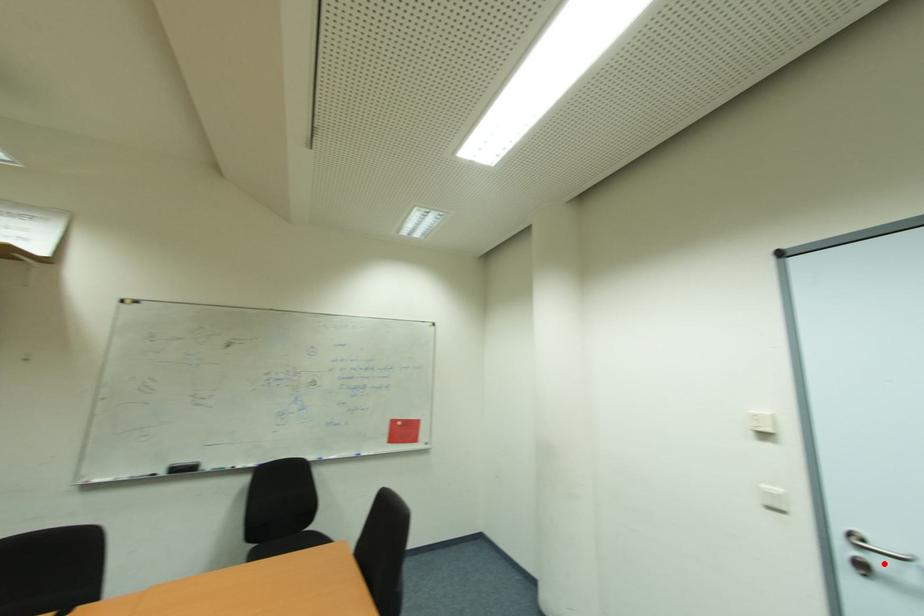
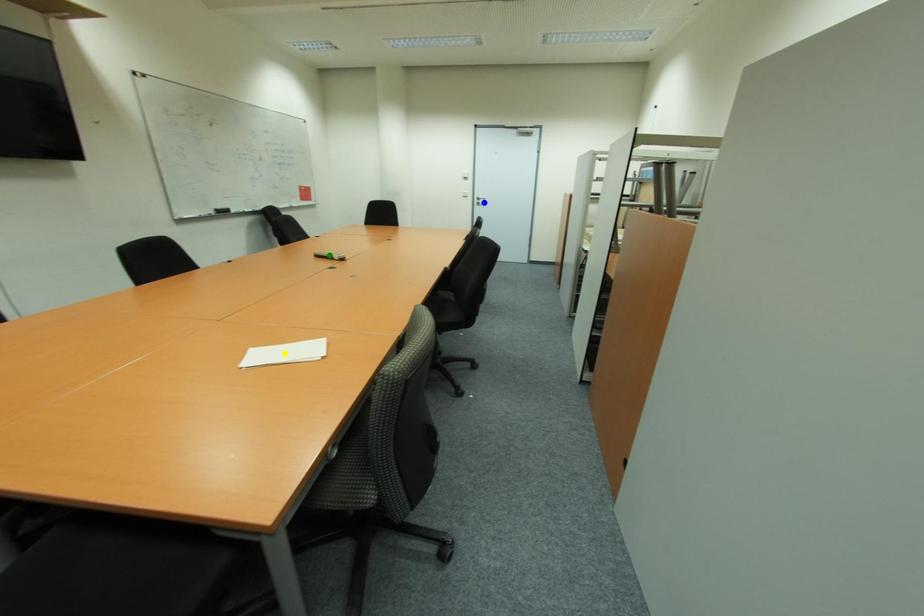
Question: I am providing you with two images of the same scene from different viewpoints. A red point is marked on the first image. You are given multiple points on the second image. Which point in image 2 is actually the same real-world point as the red point in image 1?

Choices:
 (A) blue point
 (B) green point
 (C) yellow point

Answer: (A)